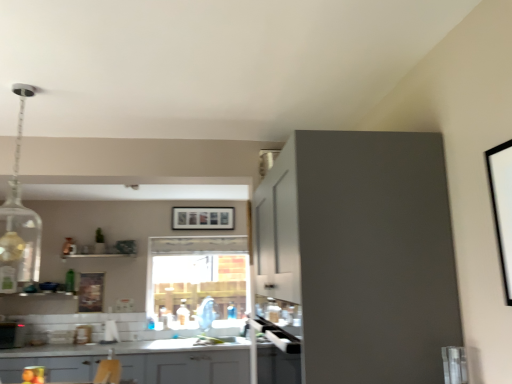
Question: Is green glass bottle at lower left oriented away from matte gray cabinets at lower center, the second cabinetry from the right?

Choices:
 (A) no
 (B) yes

Answer: (A)

Question: Does green glass bottle at lower left have a lesser width compared to matte gray cabinets at lower center, the second cabinetry positioned from the front?

Choices:
 (A) no
 (B) yes

Answer: (B)

Question: Does green glass bottle at lower left turn towards matte gray cabinets at lower center, positioned as the 1th cabinetry in back-to-front order?

Choices:
 (A) no
 (B) yes

Answer: (A)

Question: Is green glass bottle at lower left not near matte gray cabinets at lower center, which is the 1th cabinetry in bottom-to-top order?

Choices:
 (A) yes
 (B) no

Answer: (A)

Question: Is green glass bottle at lower left not within matte gray cabinets at lower center, which ranks as the 2th cabinetry in top-to-bottom order?

Choices:
 (A) yes
 (B) no

Answer: (A)

Question: Does green glass bottle at lower left have a larger size compared to matte gray cabinets at lower center, which ranks as the 2th cabinetry in top-to-bottom order?

Choices:
 (A) no
 (B) yes

Answer: (A)

Question: Does matte gray cabinet at upper right, the 1th cabinetry in the right-to-left sequence, have a greater height compared to white matte picture frame at upper right, placed as the third picture frame when sorted from back to front?

Choices:
 (A) no
 (B) yes

Answer: (B)

Question: Can you confirm if matte gray cabinet at upper right, which is the second cabinetry from bottom to top, is smaller than white matte picture frame at upper right, placed as the third picture frame when sorted from back to front?

Choices:
 (A) yes
 (B) no

Answer: (B)

Question: Is matte gray cabinet at upper right, which is the 1th cabinetry from front to back, looking in the opposite direction of white matte picture frame at upper right, which ranks as the third picture frame in left-to-right order?

Choices:
 (A) yes
 (B) no

Answer: (B)

Question: Does matte gray cabinet at upper right, arranged as the second cabinetry when viewed from the left, have a greater width compared to white matte picture frame at upper right, the 1th picture frame from the top?

Choices:
 (A) yes
 (B) no

Answer: (A)

Question: Is matte gray cabinet at upper right, the first cabinetry in the top-to-bottom sequence, not close to white matte picture frame at upper right, which ranks as the third picture frame in left-to-right order?

Choices:
 (A) no
 (B) yes

Answer: (A)

Question: Is matte gray cabinet at upper right, which is the second cabinetry from bottom to top, to the right of white matte picture frame at upper right, which is the first picture frame in front-to-back order, from the viewer's perspective?

Choices:
 (A) no
 (B) yes

Answer: (A)

Question: From a real-world perspective, is green glass bottle at lower left located higher than metallic silver toaster at lower left?

Choices:
 (A) yes
 (B) no

Answer: (A)